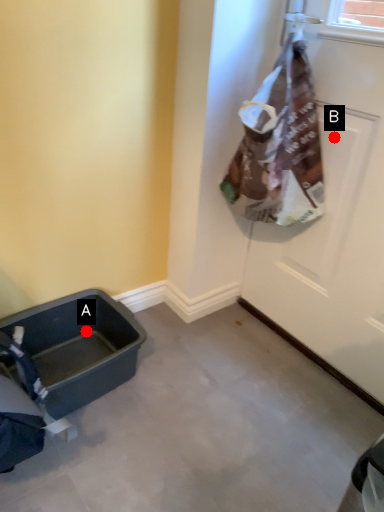
Question: Two points are circled on the image, labeled by A and B beside each circle. Which point is closer to the camera?

Choices:
 (A) A is closer
 (B) B is closer

Answer: (B)